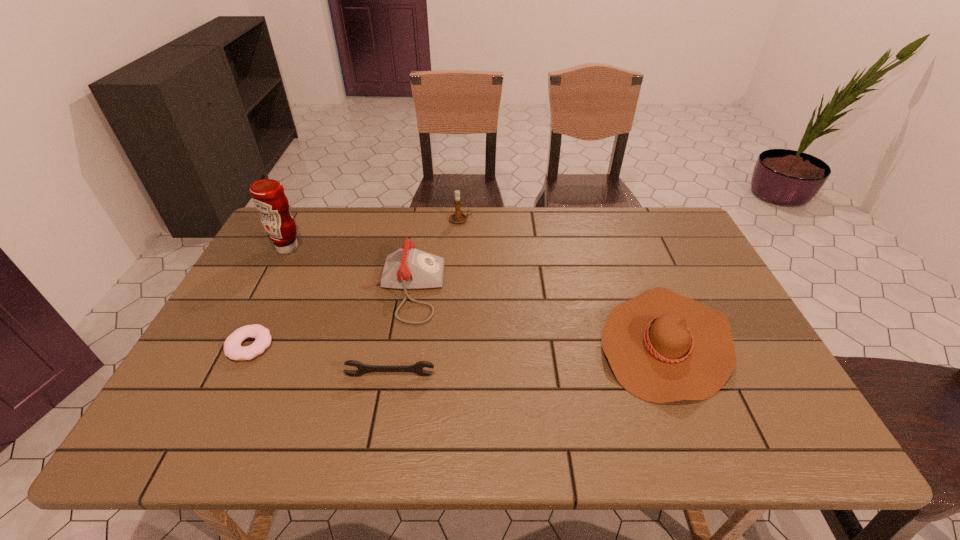
Find the location of a particular element. This screenshot has width=960, height=540. object positioned at the far left corner is located at coordinates click(268, 196).

This screenshot has height=540, width=960. I want to click on blank area at the far edge, so click(468, 232).

Locate an element on the screen. This screenshot has height=540, width=960. free spot at the near edge of the desktop is located at coordinates (415, 419).

This screenshot has width=960, height=540. Identify the location of vacant space at the left edge of the desktop. (187, 382).

The image size is (960, 540). Identify the location of vacant space at the right edge of the desktop. (685, 290).

The width and height of the screenshot is (960, 540). Identify the location of vacant point located between the wrench and the fifth object from left to right. coord(425,298).

Locate an element on the screen. vacant space in between the candle holder and the third shortest object is located at coordinates (564, 281).

The height and width of the screenshot is (540, 960). I want to click on unoccupied position between the condiment and the cowboy hat, so pos(477,295).

I want to click on vacant space in between the shortest object and the farthest object, so click(355, 283).

Locate an element on the screen. Image resolution: width=960 pixels, height=540 pixels. free spot between the cowboy hat and the farthest object is located at coordinates (564, 281).